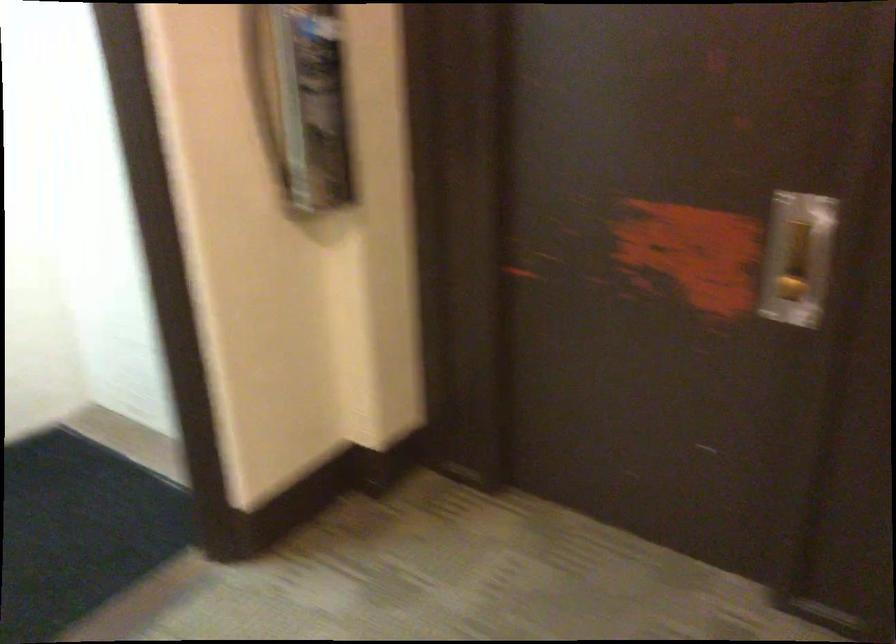
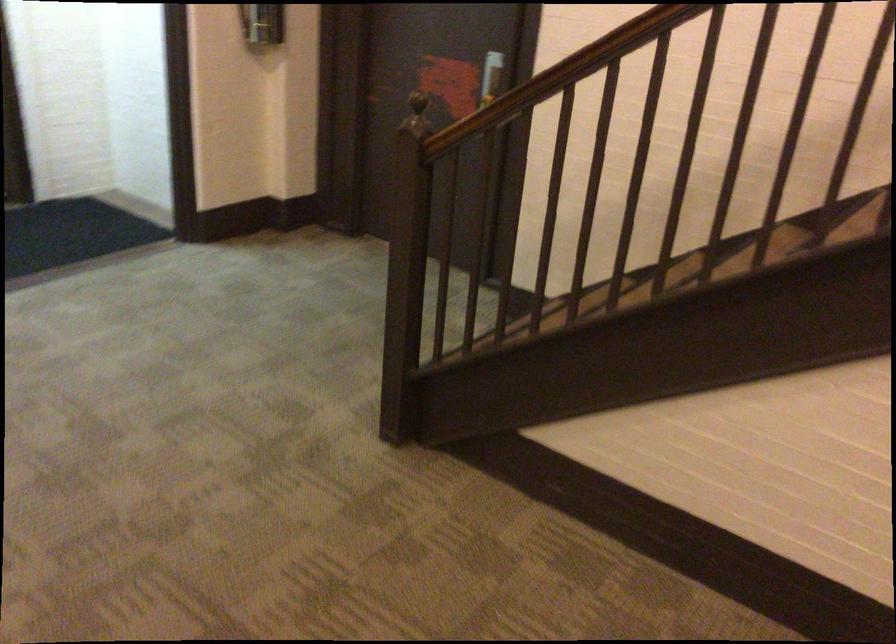
Question: I am providing you with two images of the same scene from different viewpoints. After the viewpoint changes to image2, which objects are now occluded?

Choices:
 (A) glass jar with label
 (B) brown stair handrail
 (C) recessed door handle
 (D) brown wood finial

Answer: (C)